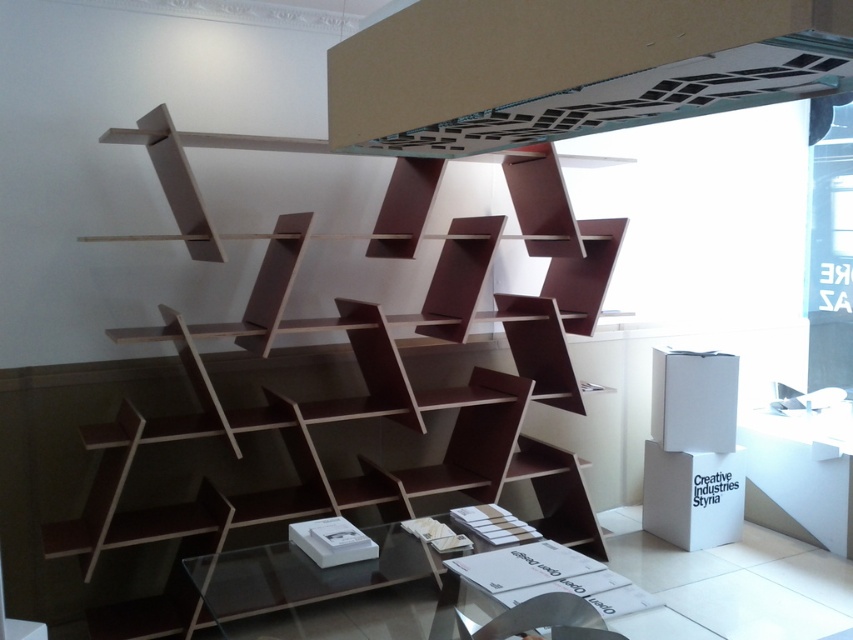
Measure the distance between brown matte bookcase at center and camera.

7.91 feet

Does brown matte bookcase at center appear on the left side of matte white exhaust hood at upper center?

Correct, you'll find brown matte bookcase at center to the left of matte white exhaust hood at upper center.

Is point (302, 220) positioned after point (502, 113)?

Yes, it is behind point (502, 113).

At what (x,y) coordinates should I click in order to perform the action: click on brown matte bookcase at center. Please return your answer as a coordinate pair (x, y). The height and width of the screenshot is (640, 853). Looking at the image, I should click on (378, 371).